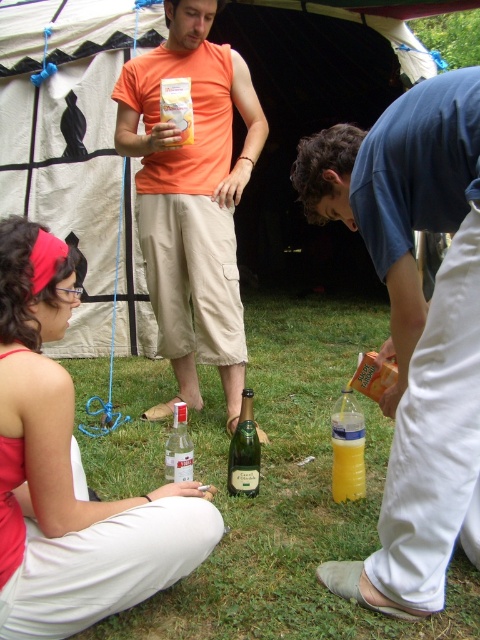
Looking at this image, you are standing at the center of the tent and want to find the green grass at lower center. According to the coordinates provided, in which direction should you look to locate it?

The green grass at lower center is located at coordinates point (x=291, y=497), so you should look towards the lower center direction to find it.